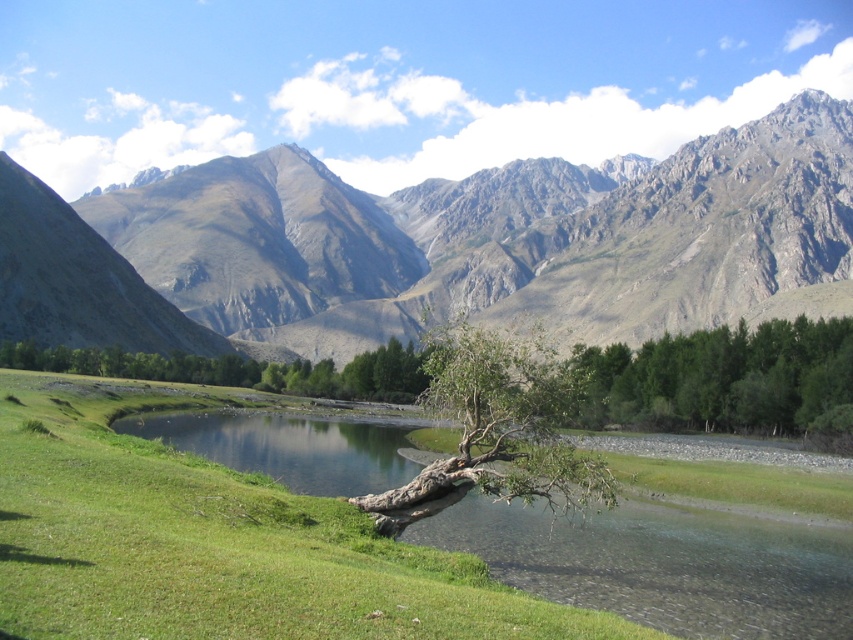
Question: Is clear water at center wider than brown textured tree at center?

Choices:
 (A) no
 (B) yes

Answer: (B)

Question: Which of the following is the farthest from the observer?

Choices:
 (A) green leafy trees at lower right
 (B) clear water at center
 (C) rugged stone mountains at upper center

Answer: (C)

Question: Among these objects, which one is farthest from the camera?

Choices:
 (A) brown rough tree trunk at lower center
 (B) brown textured tree at center
 (C) green leafy trees at lower right

Answer: (C)

Question: Which point is farther from the camera taking this photo?

Choices:
 (A) (810, 413)
 (B) (444, 502)

Answer: (A)

Question: Where is brown textured tree at center located in relation to brown rough tree trunk at lower center in the image?

Choices:
 (A) left
 (B) right

Answer: (B)

Question: Where is green leafy trees at lower right located in relation to brown rough tree trunk at lower center in the image?

Choices:
 (A) above
 (B) below

Answer: (A)